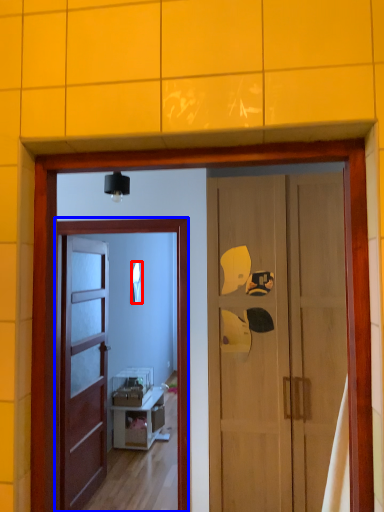
Question: Which object appears closest to the camera in this image, mirror (highlighted by a red box) or screen door (highlighted by a blue box)?

Choices:
 (A) mirror
 (B) screen door

Answer: (B)